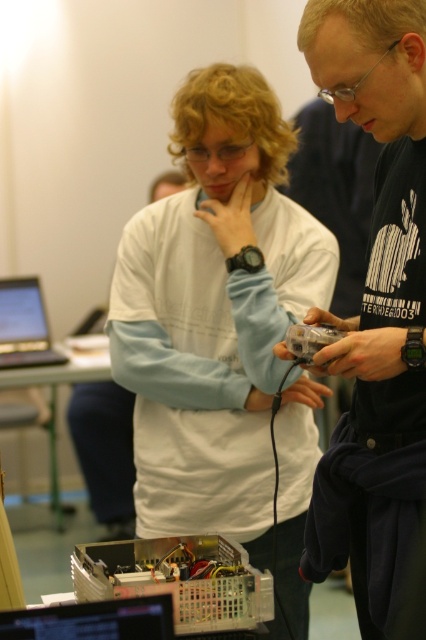
You are a technician trying to locate two points marked in the image. Which point, point (353, 61) or point (155, 545), is closer to you?

Point (353, 61) is closer to the viewer than point (155, 545).

You are a photographer trying to capture a clear shot of the black glossy laptop at lower left without including the white matte shirt at center in the frame. Based on their positions, is this possible?

The white matte shirt at center is positioned on the right side of the black glossy laptop at lower left, so if you position your camera to the left side of the laptop, you can capture the laptop without including the shirt in the frame.